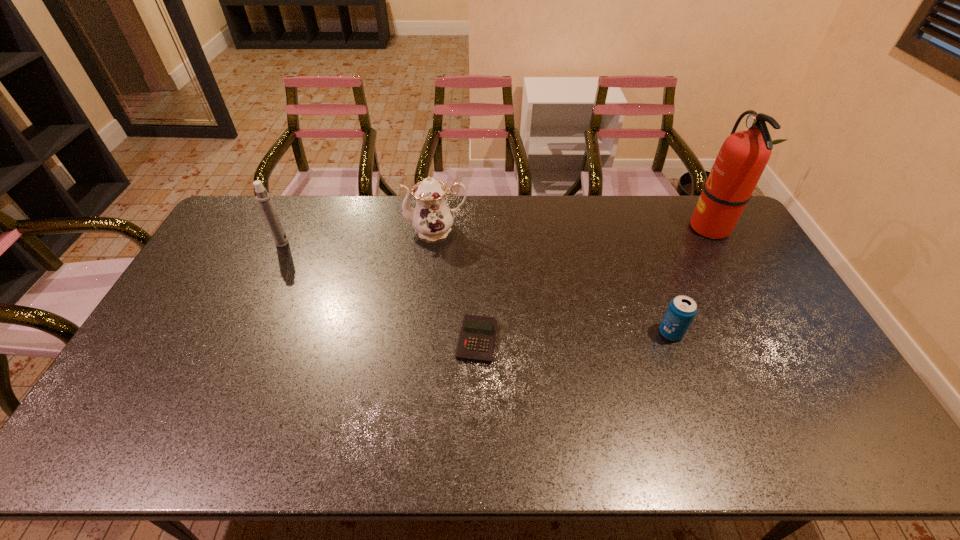
This screenshot has height=540, width=960. Identify the location of free space at the left edge. (187, 380).

Image resolution: width=960 pixels, height=540 pixels. I want to click on vacant space at the right edge of the desktop, so click(723, 278).

You are a GUI agent. You are given a task and a screenshot of the screen. Output one action in this format:
    pyautogui.click(x=<x>, y=<y>)
    Task: Click on the free space between the chinaware and the fire extinguisher
    
    Given the screenshot: What is the action you would take?
    pyautogui.click(x=573, y=228)

Find the location of `empty space between the chinaware and the second shortest object`. empty space between the chinaware and the second shortest object is located at coordinates (554, 281).

The width and height of the screenshot is (960, 540). Identify the location of vacant space in between the fire extinguisher and the leftmost object. (495, 235).

The height and width of the screenshot is (540, 960). I want to click on vacant space that is in between the soda can and the chinaware, so coord(554,281).

At what (x,y) coordinates should I click in order to perform the action: click on vacant region between the rightmost object and the chinaware. Please return your answer as a coordinate pair (x, y). The image size is (960, 540). Looking at the image, I should click on (573, 228).

At what (x,y) coordinates should I click in order to perform the action: click on free space between the chinaware and the shortest object. Please return your answer as a coordinate pair (x, y). The image size is (960, 540). Looking at the image, I should click on (457, 285).

Locate an element on the screen. vacant region between the leftmost object and the shortest object is located at coordinates (380, 291).

Where is `vacant space in between the fire extinguisher and the second object from right to left`? The height and width of the screenshot is (540, 960). vacant space in between the fire extinguisher and the second object from right to left is located at coordinates [690, 280].